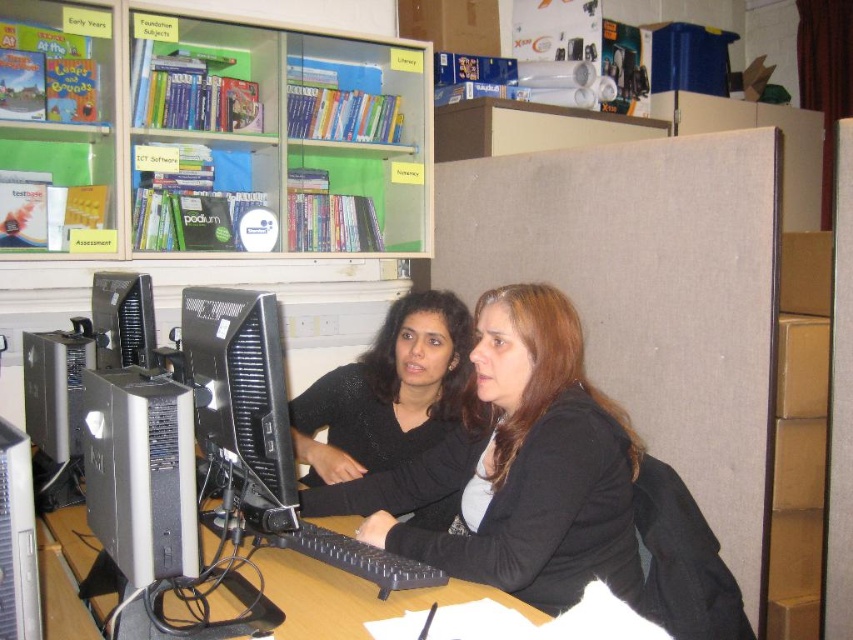
In the scene shown: You are organizing items in the workspace. You have a clear plastic bookshelf at upper left and a black matte sweater at center. Which item is wider?

The clear plastic bookshelf at upper left is wider than the black matte sweater at center.

You are setting up a new monitor stand for the matte black monitor at left and need to ensure it doesn not block the clear plastic bookshelf at upper left. Based on the scene, is this possible?

The clear plastic bookshelf at upper left is located above the matte black monitor at left, so placing the new monitor stand would not interfere with the bookshelf as it is positioned below.

You are a delivery person who needs to place a small package between the black matte sweater at center and the matte black monitor at left. Can you fit the package there if it measures 23 inches in length?

The distance between the black matte sweater at center and the matte black monitor at left is 22.93 inches. Since the package is 23 inches long, it will not fit between them as the space is slightly smaller than the package.